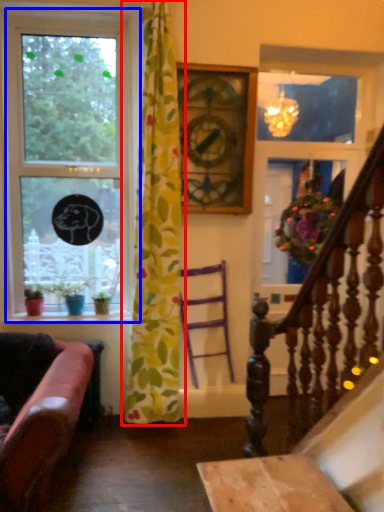
Question: Which object is closer to the camera taking this photo, curtain (highlighted by a red box) or window (highlighted by a blue box)?

Choices:
 (A) curtain
 (B) window

Answer: (A)